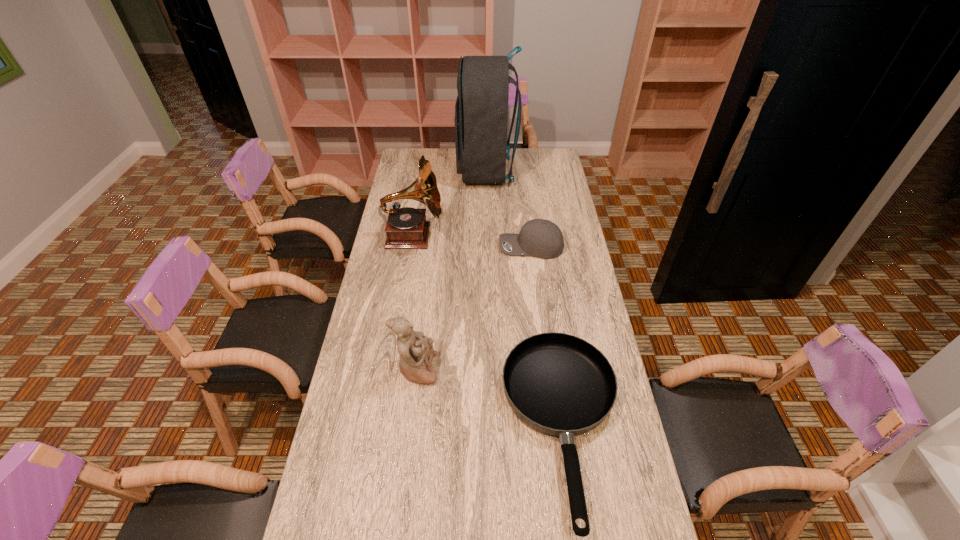
Find the location of `backpack`. backpack is located at coordinates (481, 111).

Identify the location of the farthest object. (481, 111).

Find the location of a particular element. the fourth shortest object is located at coordinates (406, 227).

Find the location of a particular element. the third shortest object is located at coordinates (416, 352).

Identify the location of the second shortest object. (540, 238).

Where is `free space located 0.070m on the front-facing side of the farthest object`? free space located 0.070m on the front-facing side of the farthest object is located at coordinates (443, 171).

This screenshot has height=540, width=960. In order to click on vacant position located on the front-facing side of the farthest object in this screenshot , I will do `click(428, 171)`.

What are the coordinates of `vacant space located 0.150m on the front-facing side of the farthest object` in the screenshot? It's located at (426, 171).

Locate an element on the screen. vacant space situated 0.050m on the horn of the second tallest object is located at coordinates (455, 236).

Image resolution: width=960 pixels, height=540 pixels. I want to click on vacant space located on the front-facing side of the third shortest object, so click(x=511, y=369).